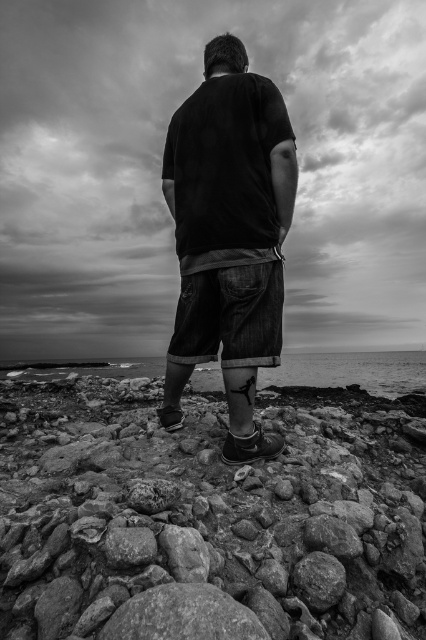
You are a photographer trying to capture the scene from the same angle. You notice the smooth rock at center and denim shorts at center. Which object is taller in the image?

The smooth rock at center is not as tall as denim shorts at center, so the denim shorts at center is taller.

You are a geologist examining the rocky shoreline in the image. You notice a smooth rock at center. Can you determine its exact location in the image using coordinates?

The smooth rock at center is located at coordinates point (207, 516).

You are a photographer trying to capture the rugged shoreline. You notice the denim shorts at center and the smooth water at lower center in your frame. Which object occupies more horizontal space in the image?

The smooth water at lower center occupies more horizontal space because the denim shorts at center has a lesser width compared to it.